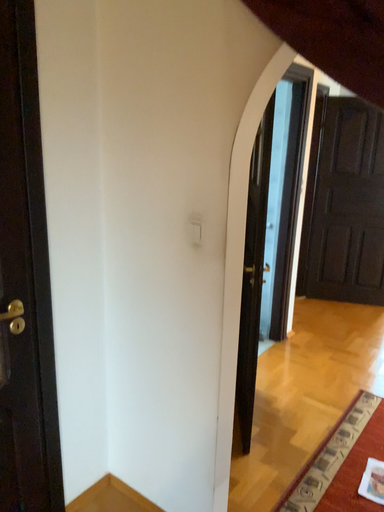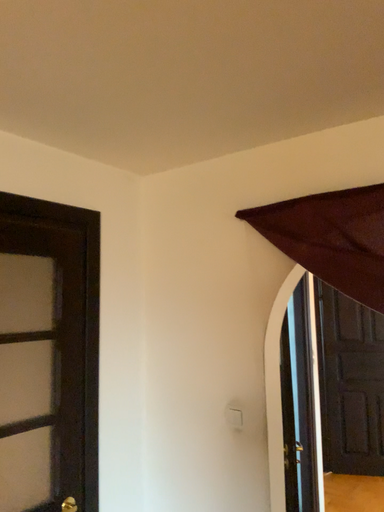
Question: How did the camera likely rotate when shooting the video?

Choices:
 (A) rotated downward
 (B) rotated upward

Answer: (B)